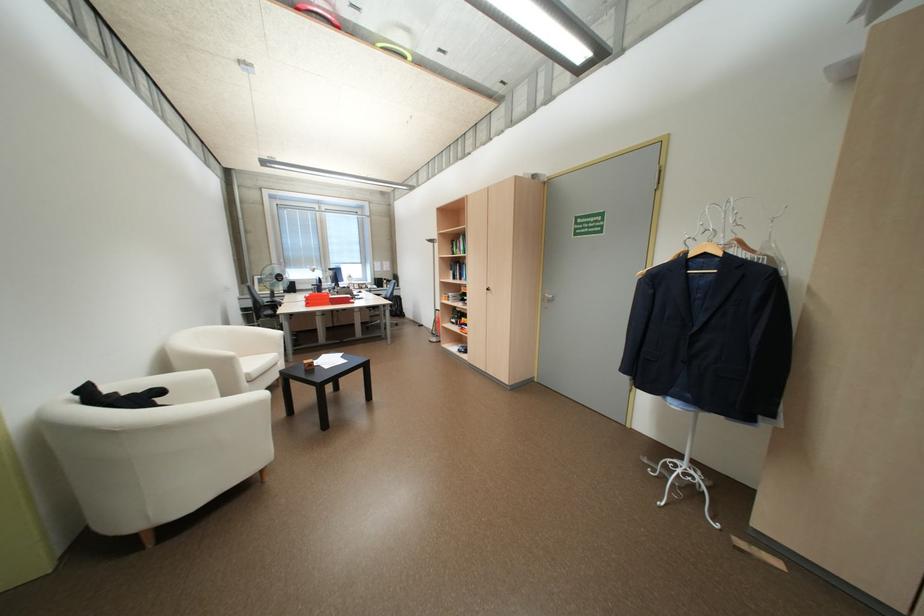
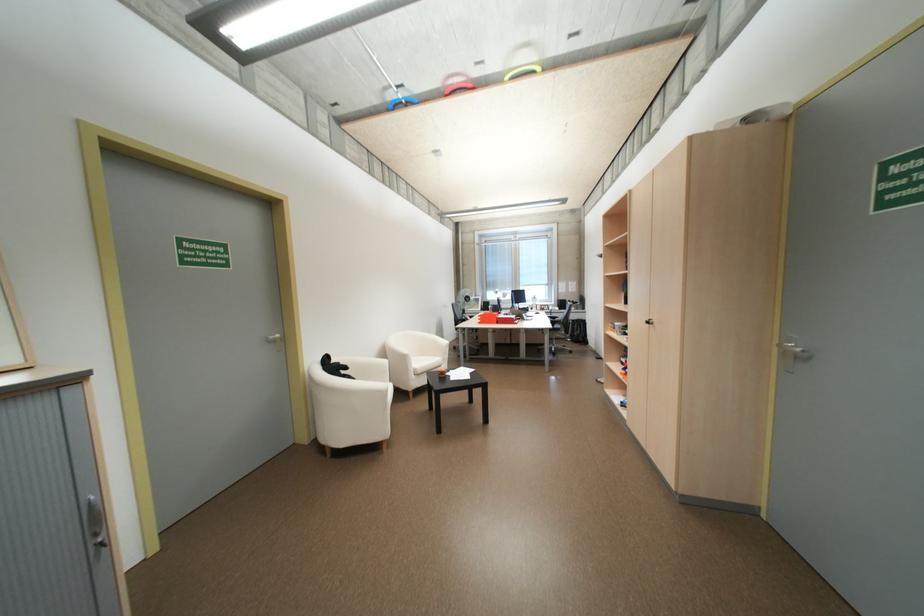
In the second image, find the point that corresponds to (x=258, y=374) in the first image.

(424, 369)